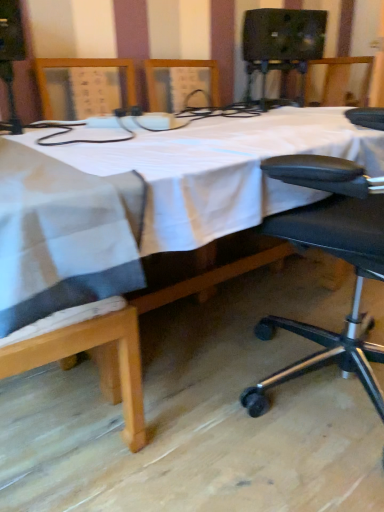
Question: Is white cloth-covered table at center wider or thinner than black fabric chair at lower right?

Choices:
 (A) wide
 (B) thin

Answer: (A)

Question: Is point (39, 340) positioned closer to the camera than point (365, 224)?

Choices:
 (A) farther
 (B) closer

Answer: (B)

Question: In the image, is white cloth-covered table at center positioned in front of or behind black fabric chair at lower right?

Choices:
 (A) front
 (B) behind

Answer: (A)

Question: Looking at the image, does black fabric chair at lower right seem bigger or smaller compared to white cloth-covered table at center?

Choices:
 (A) small
 (B) big

Answer: (A)

Question: From the image's perspective, is black fabric chair at lower right above or below white cloth-covered table at center?

Choices:
 (A) below
 (B) above

Answer: (A)

Question: Based on their positions, is black fabric chair at lower right located to the left or right of white cloth-covered table at center?

Choices:
 (A) right
 (B) left

Answer: (A)

Question: Is black fabric chair at lower right in front of or behind white cloth-covered table at center in the image?

Choices:
 (A) behind
 (B) front

Answer: (A)